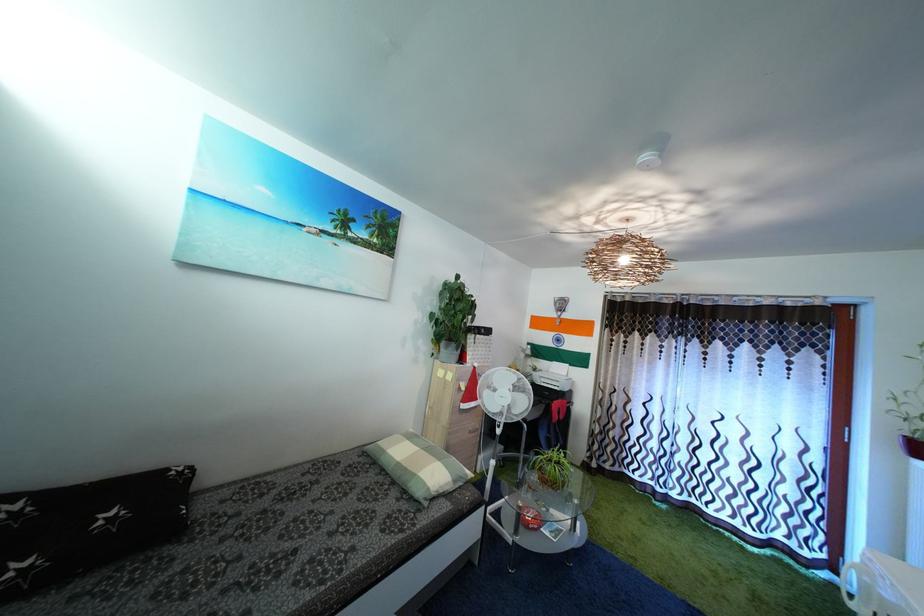
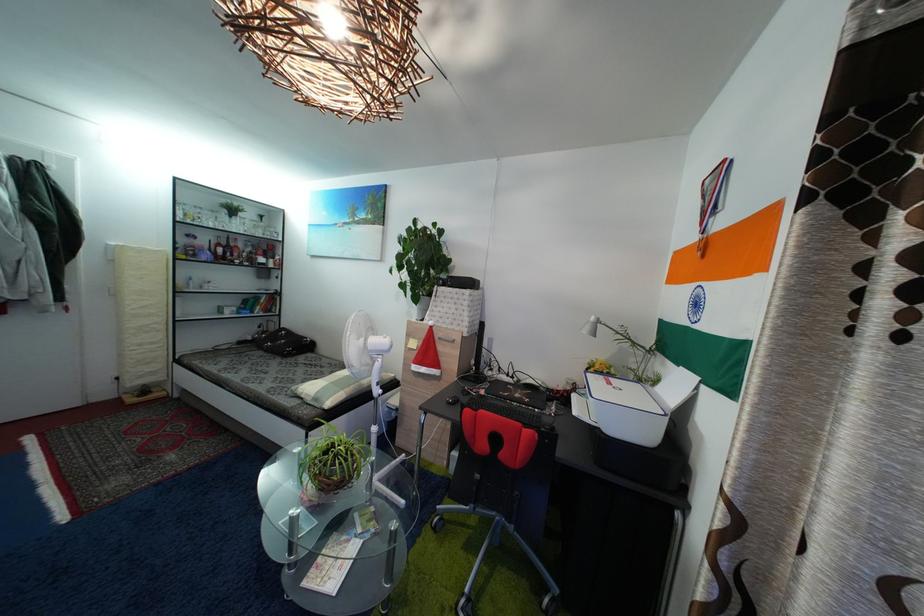
Find the pixel in the second image that matches the point at 459,493 in the first image.

(318, 407)